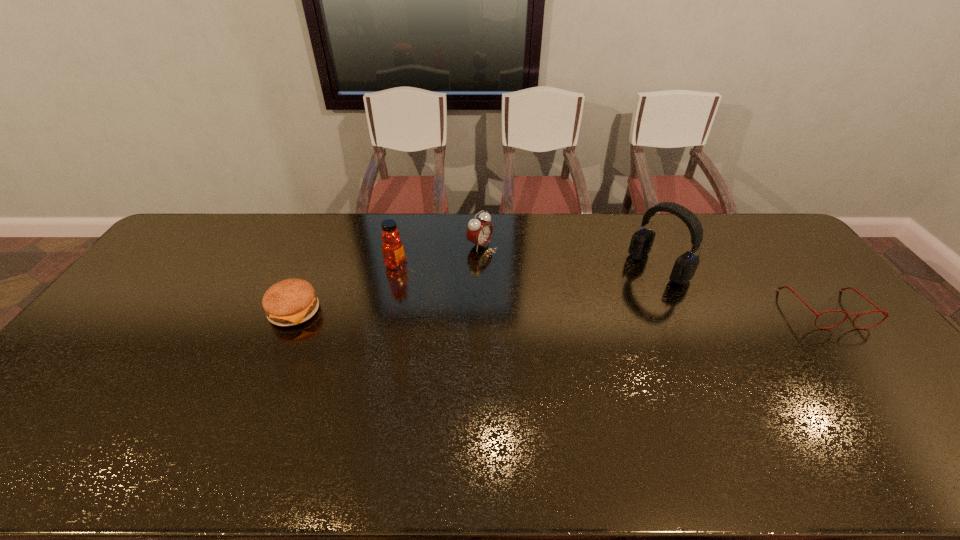
I want to click on hamburger, so click(290, 302).

I want to click on the rightmost object, so click(885, 313).

I want to click on spectacles, so click(885, 313).

I want to click on the second object from right to left, so click(685, 266).

Where is `the tallest object`? The width and height of the screenshot is (960, 540). the tallest object is located at coordinates (685, 266).

In order to click on honey in this screenshot , I will do `click(393, 251)`.

Where is `the fourth object from right to left`? the fourth object from right to left is located at coordinates (393, 251).

Locate an element on the screen. alarm clock is located at coordinates (479, 232).

The width and height of the screenshot is (960, 540). I want to click on the third object from right to left, so click(x=479, y=232).

Where is `free space located 0.150m on the left of the leftmost object`? The width and height of the screenshot is (960, 540). free space located 0.150m on the left of the leftmost object is located at coordinates (217, 311).